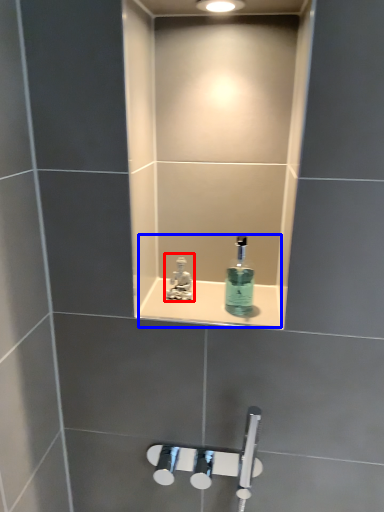
Question: Among these objects, which one is farthest to the camera, tap (highlighted by a red box) or sink (highlighted by a blue box)?

Choices:
 (A) tap
 (B) sink

Answer: (A)